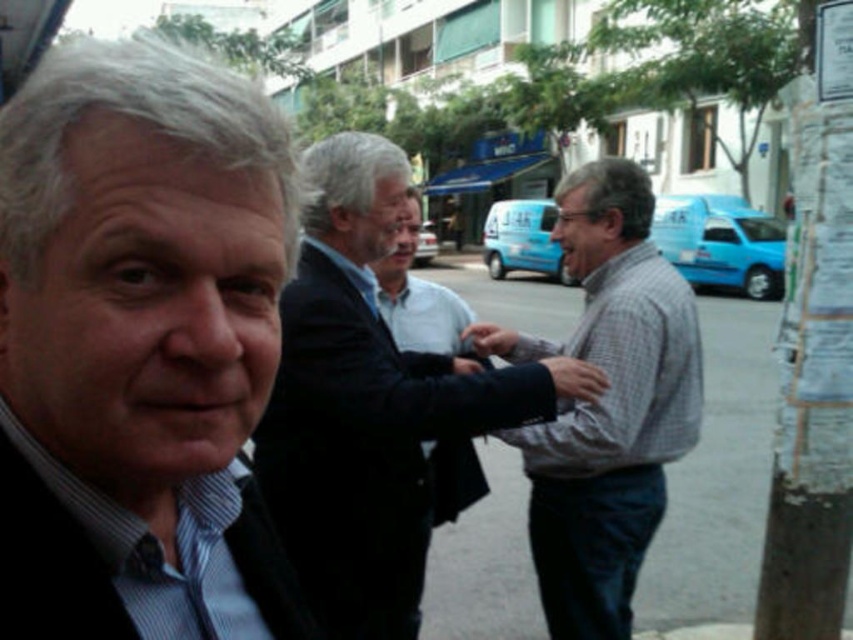
You are a photographer who wants to take a photo of the dark blue suit at center and the dark blue textured shirt at left. Based on their positions, which one is closer to the camera?

The dark blue suit at center is below the dark blue textured shirt at left, so the dark blue textured shirt at left is closer to the camera.

You are a photographer who wants to capture a clear shot of the white paper at right and the white shirt at center. Based on their sizes in the image, which object should you focus on first to ensure both are in frame?

The white paper at right might be wider than the white shirt at center, so focusing on the white paper at right first would ensure both are in frame since it requires a wider angle.

You are standing at the camera position in the street scene. There are two points marked in the image. The first point is at coordinates point (808, 458) and the second is at point (418, 208). Which point is closer to you?

Point (808, 458) is in front of point (418, 208), so it is closer to you.